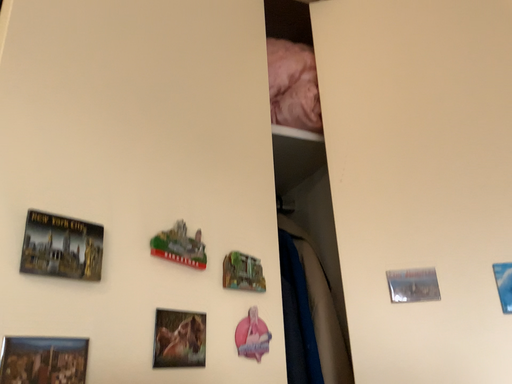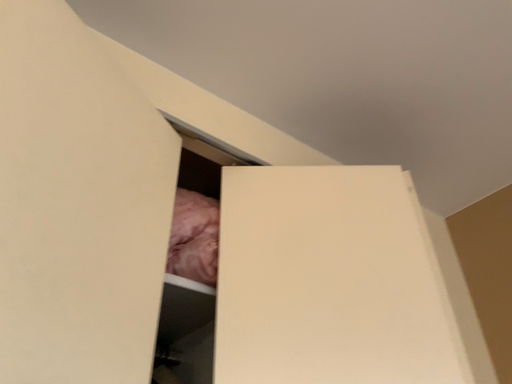
Question: How did the camera likely rotate when shooting the video?

Choices:
 (A) rotated right
 (B) rotated left

Answer: (A)